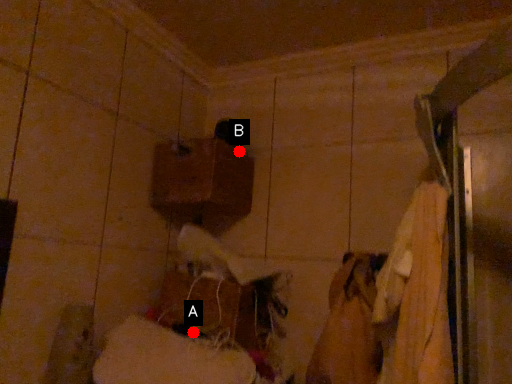
Question: Two points are circled on the image, labeled by A and B beside each circle. Which point is closer to the camera?

Choices:
 (A) A is closer
 (B) B is closer

Answer: (A)